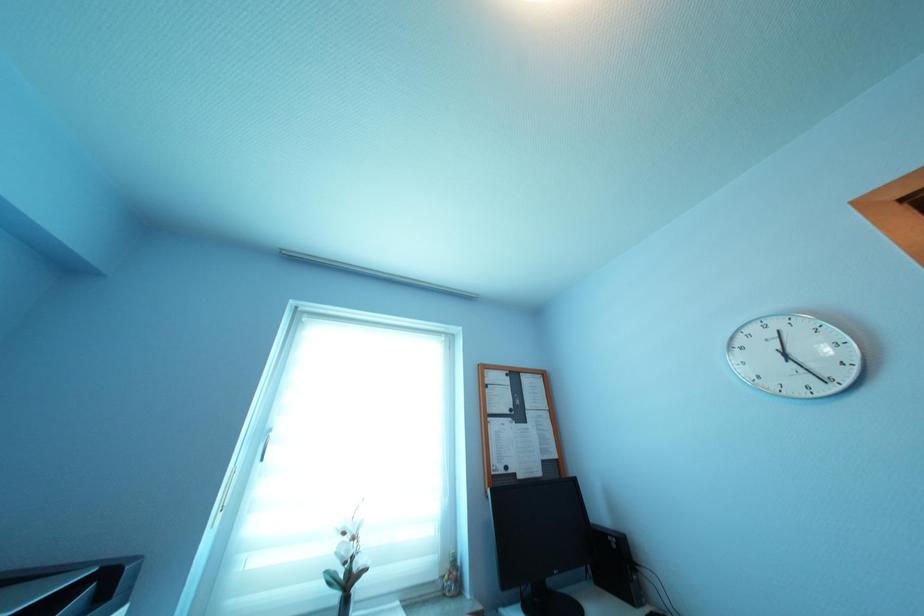
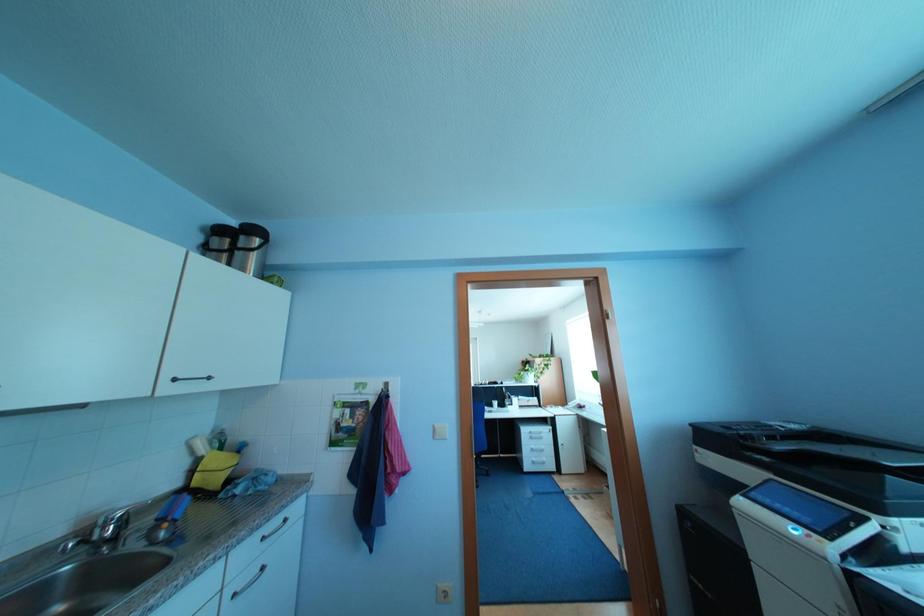
Based on the photo, how did the camera likely rotate?

The rotation direction of the camera is left-up.